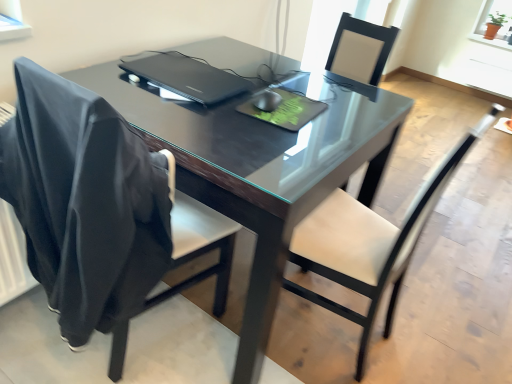
Where is `vacant area on top of terracotta clay pot at upper right (from a real-world perspective)`? vacant area on top of terracotta clay pot at upper right (from a real-world perspective) is located at coordinates (502, 2).